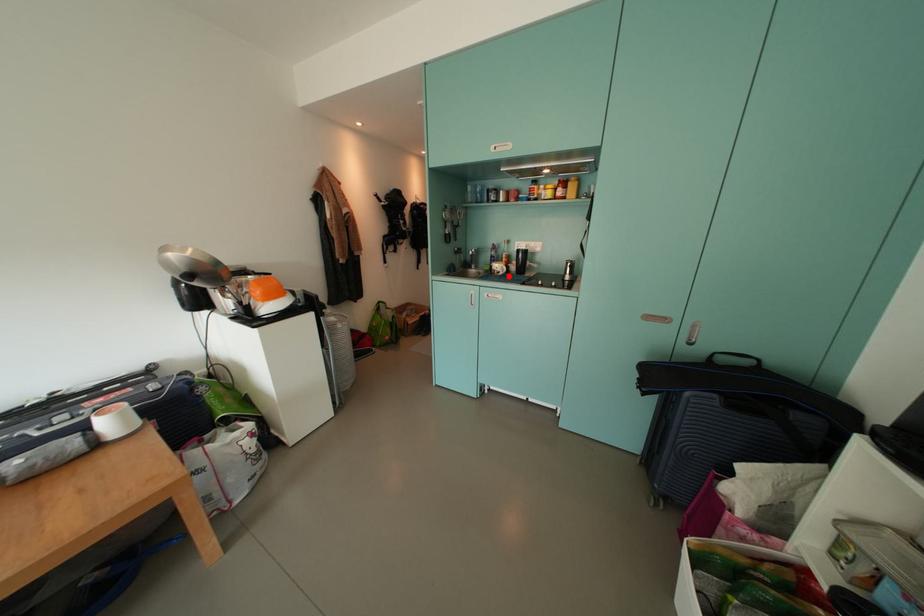
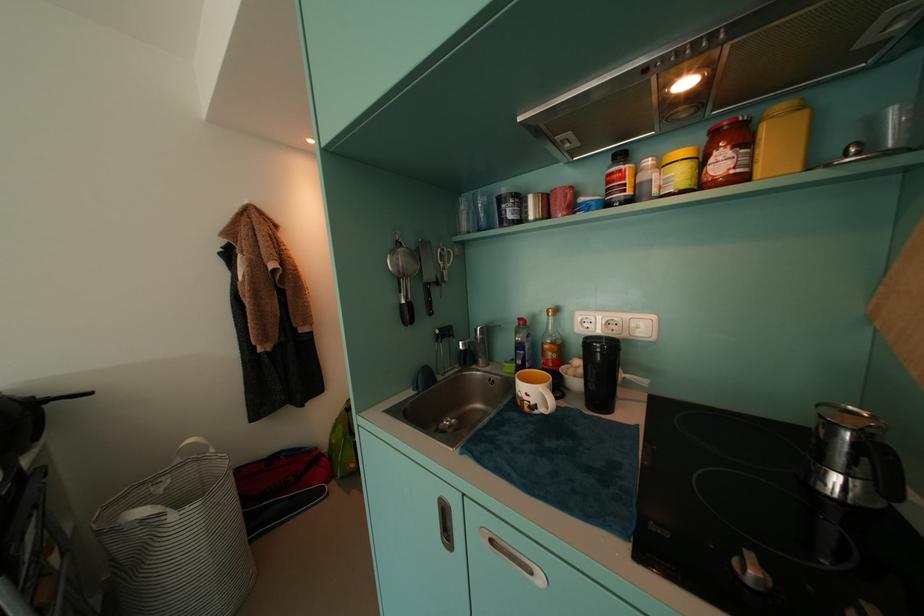
Find the pixel in the second image that matches the highlighted location in the first image.

(550, 413)